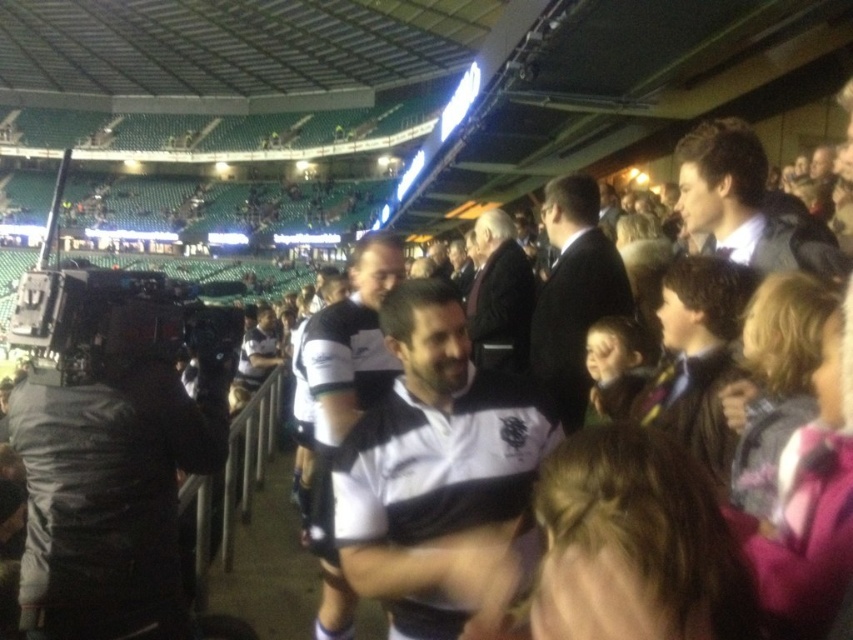
Question: Among these objects, which one is nearest to the camera?

Choices:
 (A) white jersey at center
 (B) dark blue shirt at upper right
 (C) dark suit at center
 (D) black and white jersey at center

Answer: (D)

Question: Estimate the real-world distances between objects in this image. Which object is closer to the dark blue shirt at upper right?

Choices:
 (A) dark suit at center
 (B) white jersey at center
 (C) dark brown suit at center
 (D) brown hair at right

Answer: (A)

Question: Estimate the real-world distances between objects in this image. Which object is farther from the brown hair at right?

Choices:
 (A) dark suit at center
 (B) black and white jersey at center
 (C) white jersey at center
 (D) dark brown suit at center

Answer: (D)

Question: Is brown hair at right in front of dark suit at center?

Choices:
 (A) yes
 (B) no

Answer: (A)

Question: Is white jersey at center wider than dark brown suit at center?

Choices:
 (A) no
 (B) yes

Answer: (B)

Question: Does white jersey at center have a smaller size compared to dark brown suit at center?

Choices:
 (A) no
 (B) yes

Answer: (A)